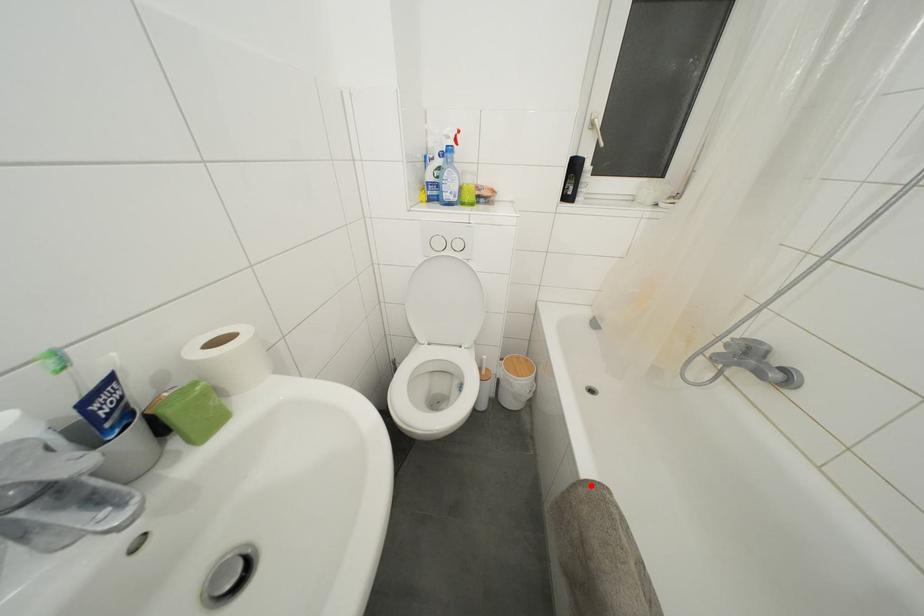
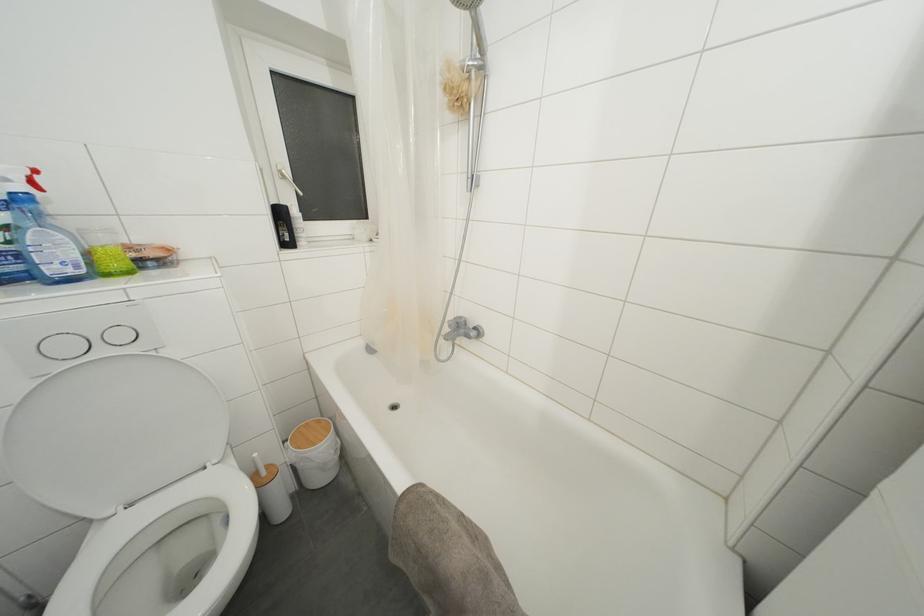
Locate, in the second image, the point that corresponds to the highlighted location in the first image.

(407, 498)